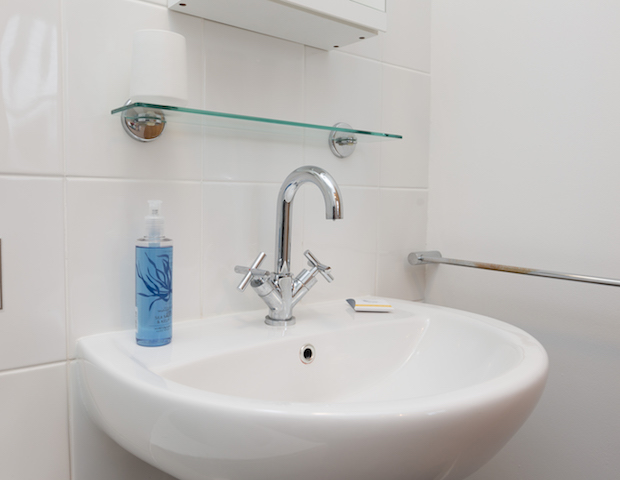
At what (x,y) coordinates should I click in order to perform the action: click on white wall. Please return your answer as a coordinate pair (x, y). Image resolution: width=620 pixels, height=480 pixels. Looking at the image, I should click on 525,167.